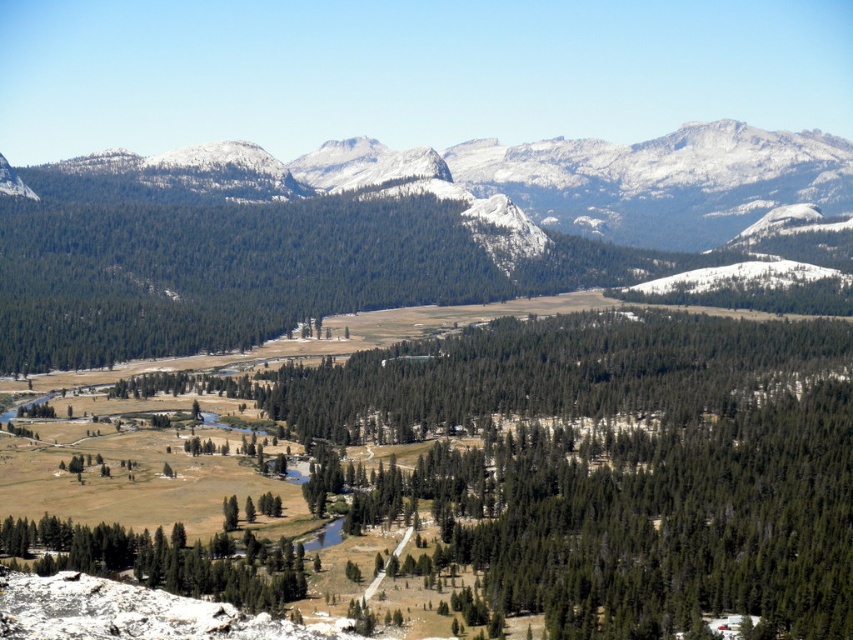
Which is in front, point (761, 200) or point (135, 557)?

Point (135, 557) is in front.

Where is `snowy granite mountains at upper center`? snowy granite mountains at upper center is located at coordinates (515, 179).

The height and width of the screenshot is (640, 853). What are the coordinates of `snowy granite mountains at upper center` in the screenshot? It's located at (515, 179).